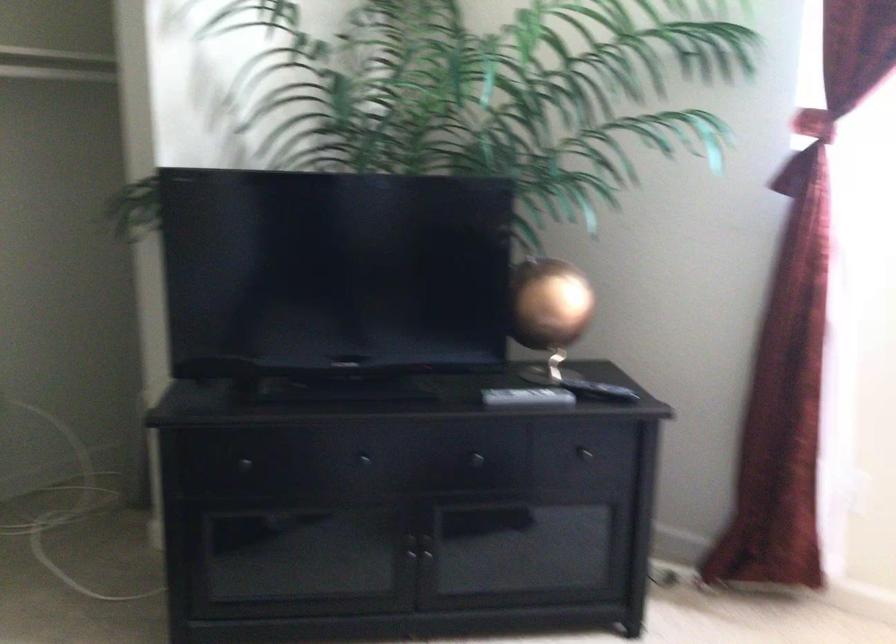
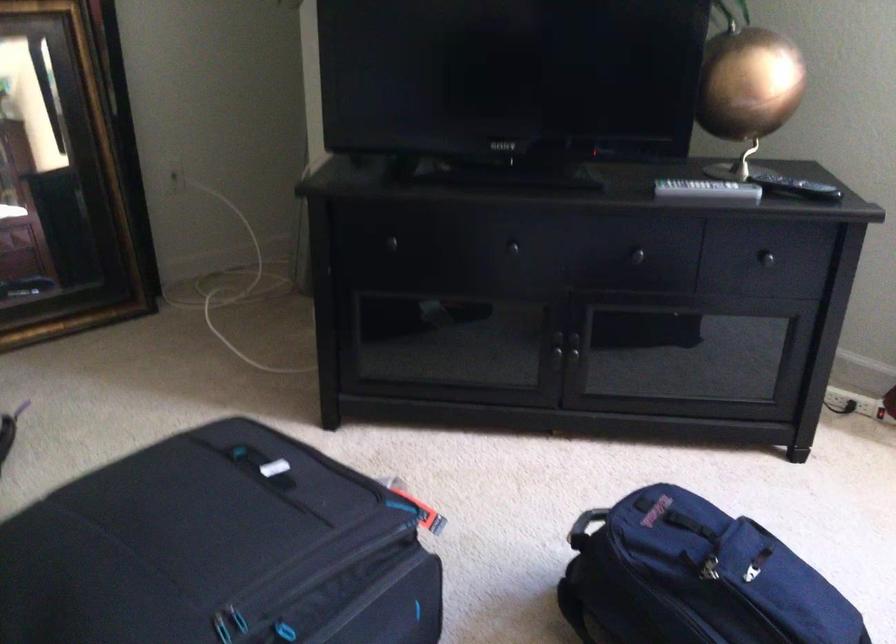
Consider the image. What movement of the cameraman would produce the second image?

The cameraman walked toward right, forward.